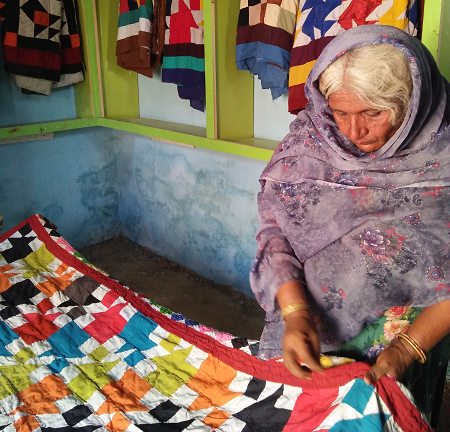
You are a GUI agent. You are given a task and a screenshot of the screen. Output one action in this format:
    pyautogui.click(x=<x>, y=<y>)
    Task: Click on the grey wall
    This screenshot has width=450, height=432.
    Given the screenshot: What is the action you would take?
    pyautogui.click(x=66, y=162)